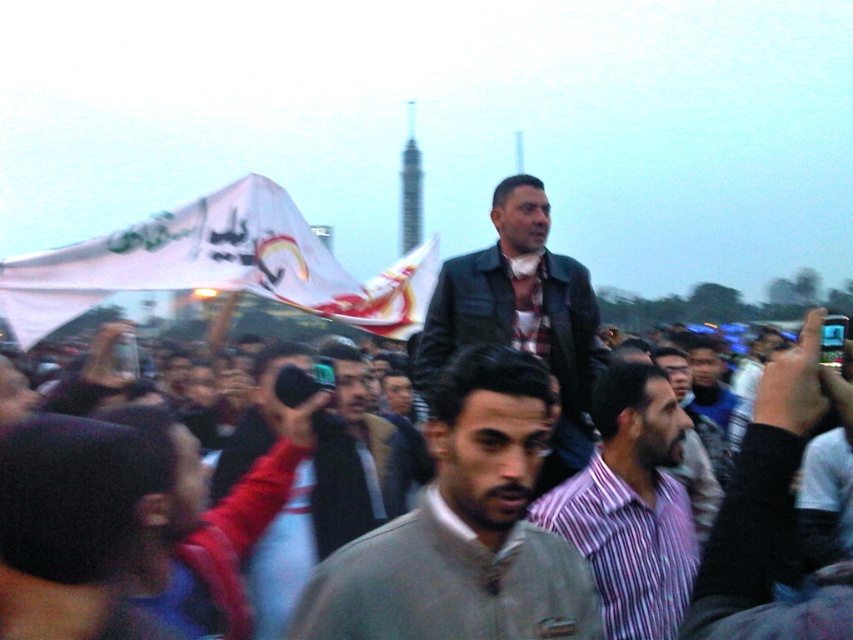
Question: Which object is positioned farthest from the gray matte jacket at center?

Choices:
 (A) white fabric flag at upper left
 (B) dark brown leather jacket at center

Answer: (A)

Question: Based on their relative distances, which object is nearer to the white fabric flag at upper left?

Choices:
 (A) dark brown leather jacket at center
 (B) striped cotton shirt at center
 (C) gray matte jacket at center

Answer: (A)

Question: Is gray matte jacket at center to the left of white fabric flag at upper left from the viewer's perspective?

Choices:
 (A) yes
 (B) no

Answer: (B)

Question: Can you confirm if white fabric flag at upper left is smaller than dark brown leather jacket at center?

Choices:
 (A) yes
 (B) no

Answer: (B)

Question: Which object is closer to the camera taking this photo?

Choices:
 (A) striped cotton shirt at center
 (B) gray sweater at center
 (C) white fabric flag at upper left

Answer: (B)

Question: Does white fabric flag at upper left have a greater width compared to dark brown leather jacket at center?

Choices:
 (A) no
 (B) yes

Answer: (B)